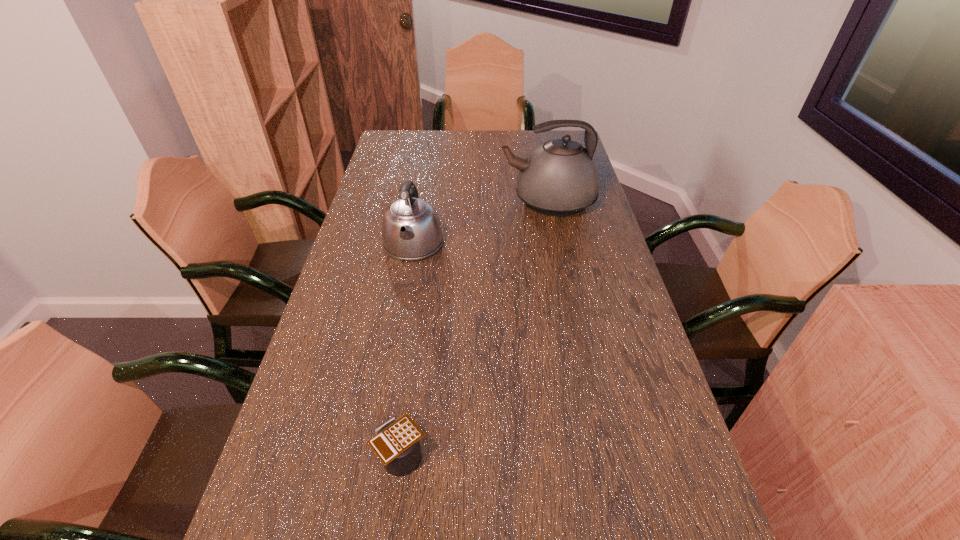
You are a GUI agent. You are given a task and a screenshot of the screen. Output one action in this format:
    pyautogui.click(x=<x>, y=<y>)
    Task: Click on the blank space located on the back of the calculator
    This screenshot has height=540, width=960.
    Given the screenshot: What is the action you would take?
    pyautogui.click(x=422, y=297)

Where is `object that is positioned at the left edge`? object that is positioned at the left edge is located at coordinates (411, 230).

The width and height of the screenshot is (960, 540). In order to click on object that is at the right edge in this screenshot , I will do click(559, 178).

Locate an element on the screen. The width and height of the screenshot is (960, 540). vacant region at the far edge is located at coordinates (492, 156).

Find the location of a particular element. This screenshot has width=960, height=540. free space at the left edge is located at coordinates (355, 456).

Locate an element on the screen. vacant space at the right edge of the desktop is located at coordinates point(601,315).

At what (x,y) coordinates should I click in order to perform the action: click on vacant space at the far left corner. Please return your answer as a coordinate pair (x, y). Looking at the image, I should click on (397, 140).

Find the location of a particular element. The image size is (960, 540). free spot between the nearest object and the tallest object is located at coordinates (475, 329).

Locate an element on the screen. empty location between the rightmost object and the nearest object is located at coordinates (475, 329).

This screenshot has width=960, height=540. I want to click on vacant space that is in between the second tallest object and the nearest object, so click(x=407, y=350).